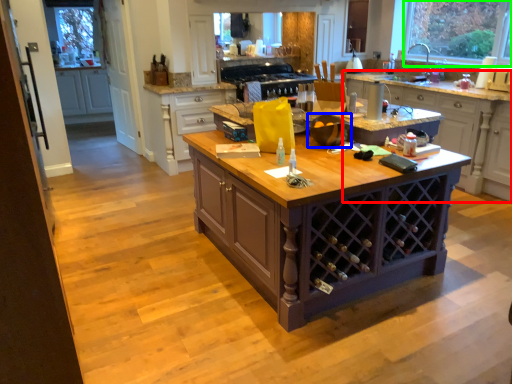
Question: Which is farther away from cabinetry (highlighted by a red box)? appliance (highlighted by a blue box) or window (highlighted by a green box)?

Choices:
 (A) appliance
 (B) window

Answer: (A)